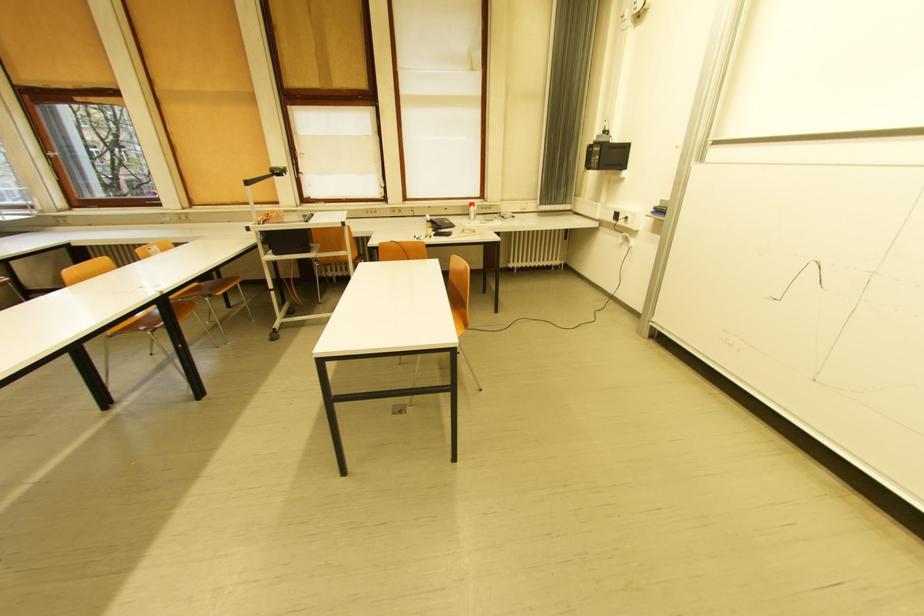
This screenshot has width=924, height=616. In order to click on blue whiteboard eraser in this screenshot , I will do `click(660, 209)`.